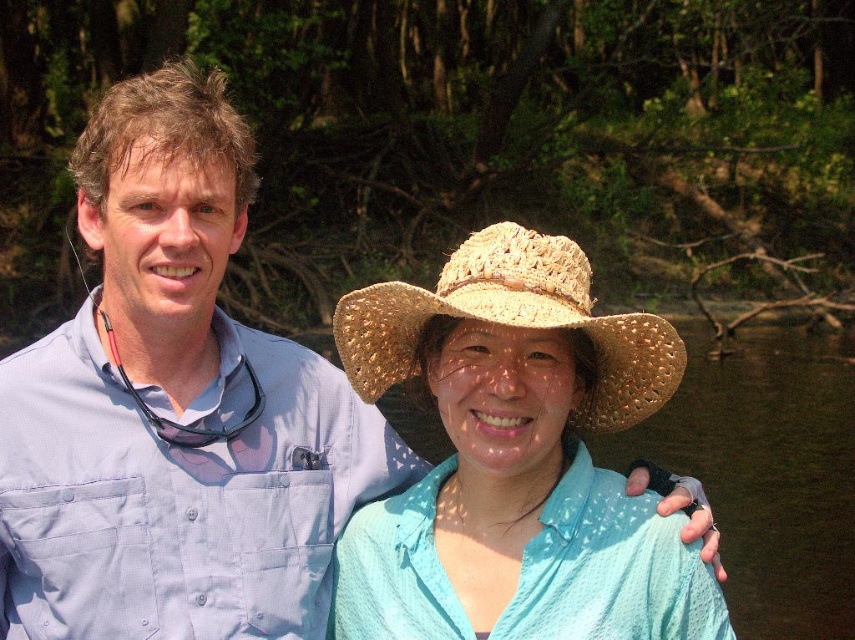
You are a photographer trying to capture a clear shot of both the woven straw hat at center and the straw woven hat at center. Based on their heights, which hat should you focus on to ensure it appears larger in the photo?

The woven straw hat at center is taller than the straw woven hat at center, so focusing on the woven straw hat at center will make it appear larger in the photo.

You are a photographer trying to capture both the woven straw hat at center and the straw woven hat at center in a single shot. Given that your camera has a fixed focus, which hat should you focus on to ensure the larger one is in clear view?

The woven straw hat at center is larger than the straw woven hat at center, so focusing on the woven straw hat at center will ensure the larger one is in clear view.